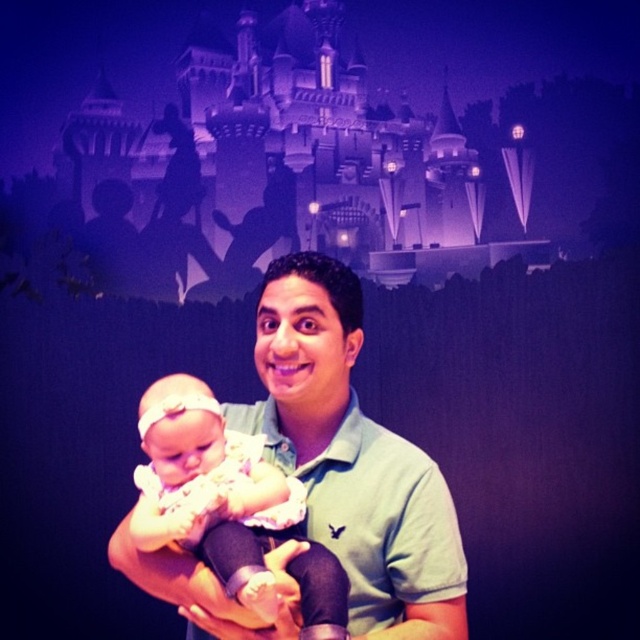
You are a photographer taking a picture of the purple stone castle at upper center and the soft pink fabric baby at center. Which object is located higher in the frame?

The purple stone castle at upper center is positioned over the soft pink fabric baby at center, so it is higher in the frame.

From the picture: You are a photographer taking a picture of the green cotton shirt at center and the soft pink fabric baby at center. Which object is taller in the photo?

The green cotton shirt at center is taller than the soft pink fabric baby at center.

From the picture: You are a photographer taking a picture of the purple stone castle at upper center and the soft pink fabric baby at center. Which object is closer to the camera?

The purple stone castle at upper center is closer to the camera because the soft pink fabric baby at center is behind it.